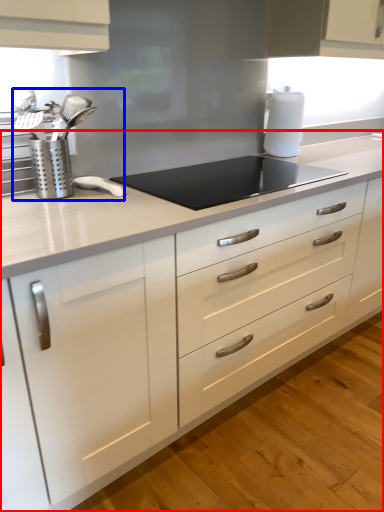
Question: Among these objects, which one is nearest to the camera, countertop (highlighted by a red box) or sink (highlighted by a blue box)?

Choices:
 (A) countertop
 (B) sink

Answer: (A)